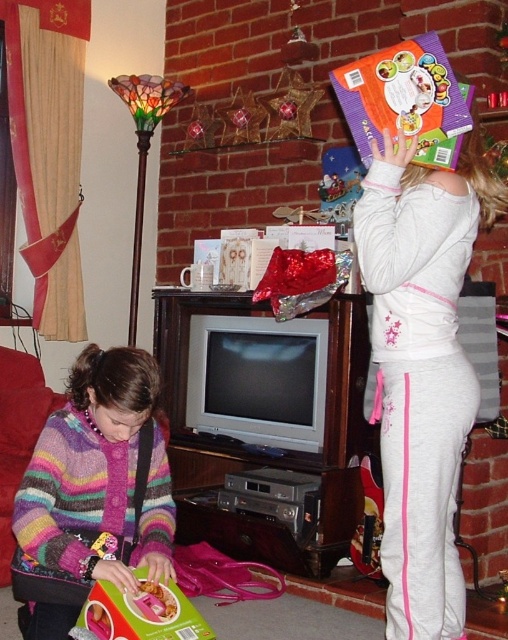
Question: From the image, what is the correct spatial relationship of matte gray sweatpants at center in relation to orange glossy cereal box at upper right?

Choices:
 (A) below
 (B) above

Answer: (A)

Question: Which of the following is the closest to the observer?

Choices:
 (A) (129, 637)
 (B) (466, 230)

Answer: (A)

Question: Which object appears closest to the camera in this image?

Choices:
 (A) orange glossy cereal box at upper right
 (B) matte pink box at lower left
 (C) striped wool sweater at lower left
 (D) matte gray sweatpants at center

Answer: (B)

Question: Considering the real-world distances, which object is farthest from the striped wool sweater at lower left?

Choices:
 (A) matte pink box at lower left
 (B) orange glossy cereal box at upper right
 (C) matte gray sweatpants at center

Answer: (B)

Question: Can you confirm if matte gray sweatpants at center is smaller than matte pink box at lower left?

Choices:
 (A) yes
 (B) no

Answer: (B)

Question: Where is striped wool sweater at lower left located in relation to orange glossy cereal box at upper right in the image?

Choices:
 (A) right
 (B) left

Answer: (B)